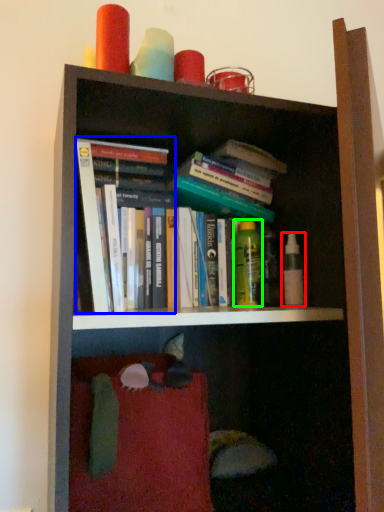
Question: Based on their relative distances, which object is farther from toiletry (highlighted by a red box)? Choose from book (highlighted by a blue box) and toiletry (highlighted by a green box).

Choices:
 (A) book
 (B) toiletry

Answer: (A)